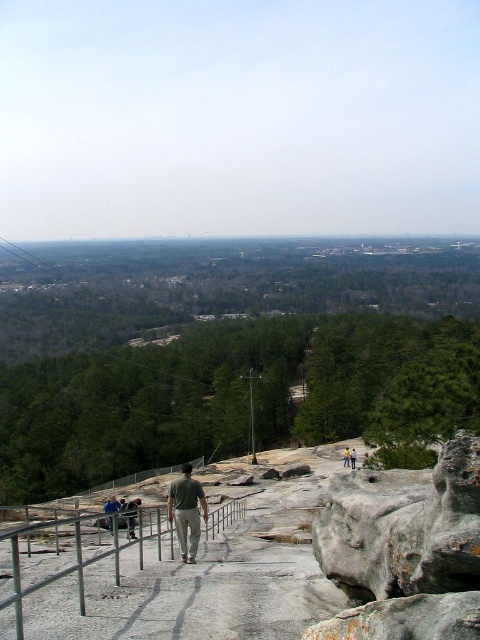
Question: Can you confirm if green matte shirt at center is positioned to the right of light brown leather jacket at center?

Choices:
 (A) yes
 (B) no

Answer: (B)

Question: Can you confirm if dark gray pants at center is smaller than light blue shirt at center?

Choices:
 (A) no
 (B) yes

Answer: (A)

Question: Which object is positioned closest to the rusty stone boulder at center?

Choices:
 (A) light blue shirt at center
 (B) light brown leather jacket at center
 (C) gray stone path at center

Answer: (C)

Question: Can you confirm if green matte shirt at center is smaller than light brown leather jacket at center?

Choices:
 (A) no
 (B) yes

Answer: (A)

Question: Among these objects, which one is nearest to the camera?

Choices:
 (A) light blue shirt at center
 (B) light brown leather jacket at center
 (C) gray stone path at center

Answer: (C)

Question: Which of the following is the farthest from the observer?

Choices:
 (A) (192, 531)
 (B) (124, 515)
 (C) (343, 452)

Answer: (C)